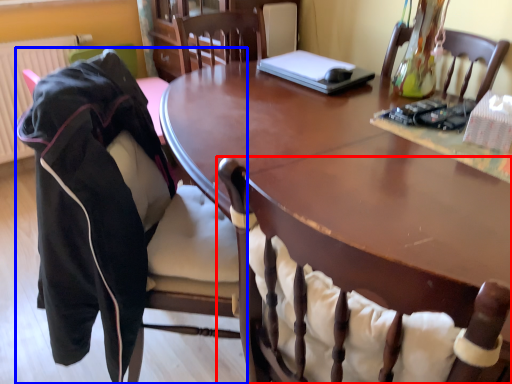
Question: Which point is further to the camera, chair (highlighted by a red box) or chair (highlighted by a blue box)?

Choices:
 (A) chair
 (B) chair

Answer: (B)